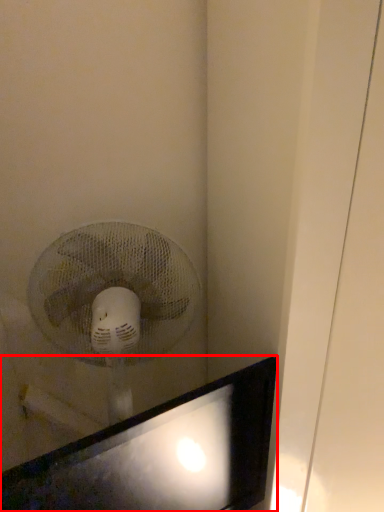
Question: From the image's perspective, considering the relative positions of computer monitor (annotated by the red box) and mechanical fan in the image provided, where is computer monitor (annotated by the red box) located with respect to the staircase?

Choices:
 (A) below
 (B) above

Answer: (A)